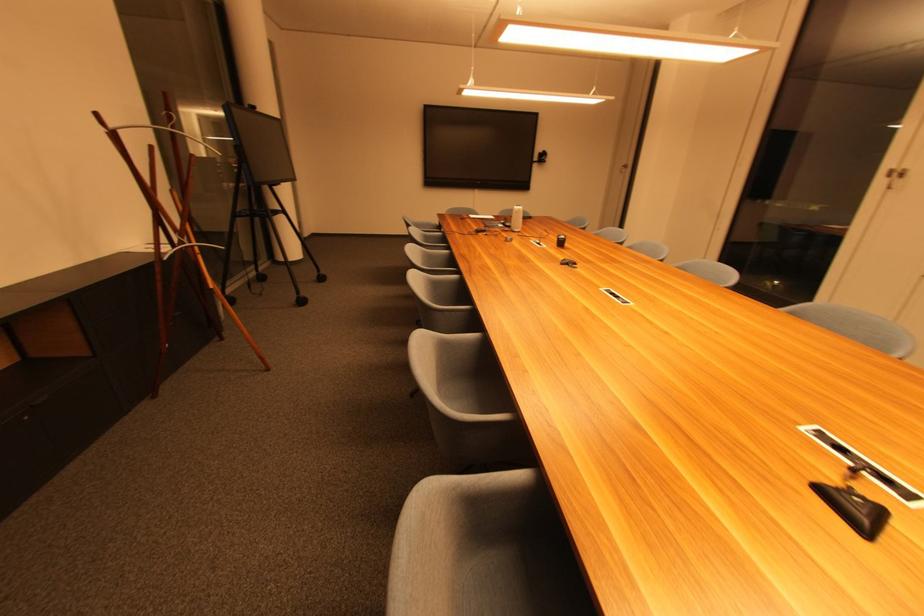
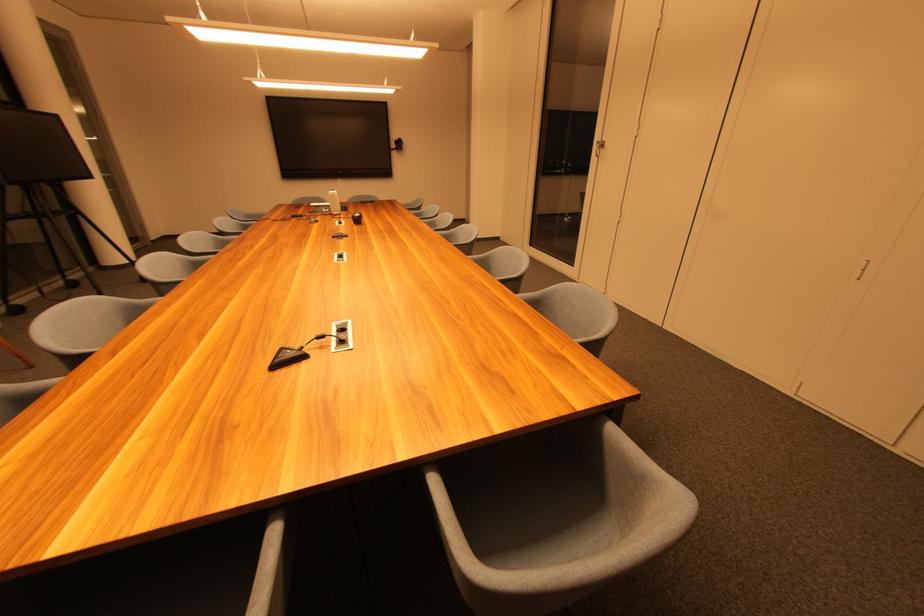
Find the pixel in the second image that matches (x=529, y=187) in the first image.

(391, 175)